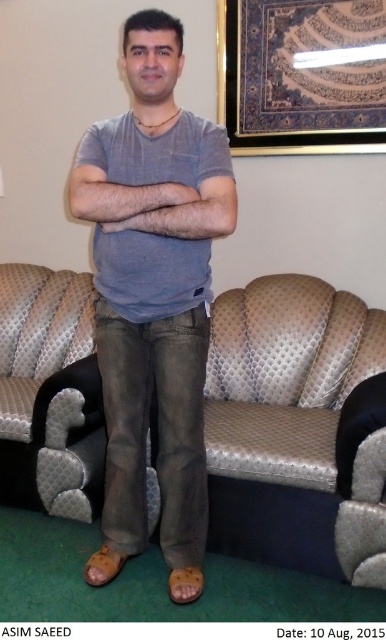
You are trying to decide if the metallic leather couch at center can fit through a doorway that is the same width as the matte gray shirt at center. Based on their sizes, can the couch fit through the doorway?

The metallic leather couch at center might be wider than matte gray shirt at center, so it is uncertain if it can fit through the doorway of the same width as the matte gray shirt at center.

From the picture: What is located at the coordinates point (292,428)?

The metallic leather couch at center is located at point (292,428).